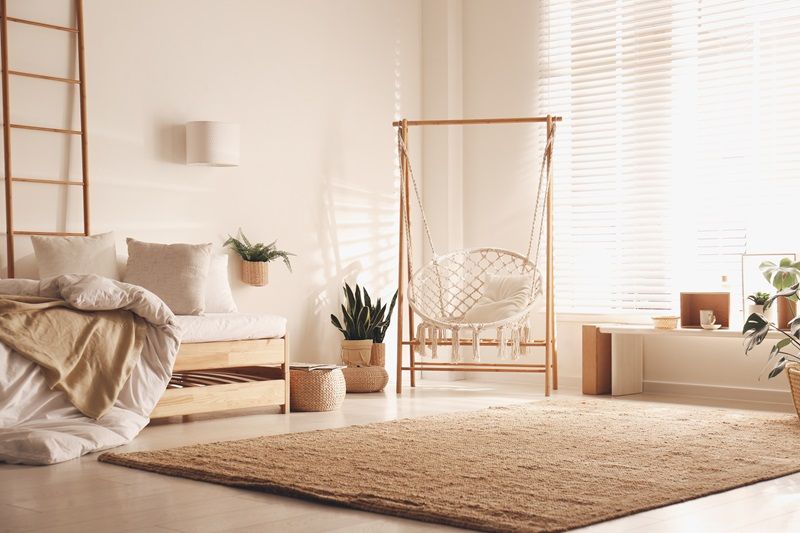
Find the location of a particular element. The image size is (800, 533). basket is located at coordinates (320, 384).